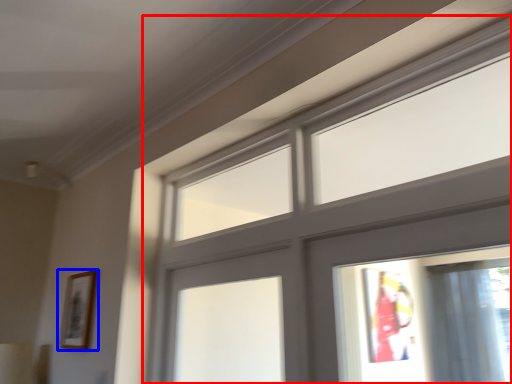
Question: Which object appears farthest to the camera in this image, window (highlighted by a red box) or picture frame (highlighted by a blue box)?

Choices:
 (A) window
 (B) picture frame

Answer: (B)